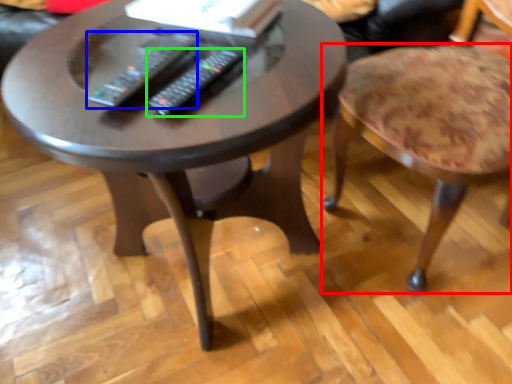
Question: Based on their relative distances, which object is nearer to stool (highlighted by a red box)? Choose from remote (highlighted by a blue box) and remote (highlighted by a green box).

Choices:
 (A) remote
 (B) remote

Answer: (B)